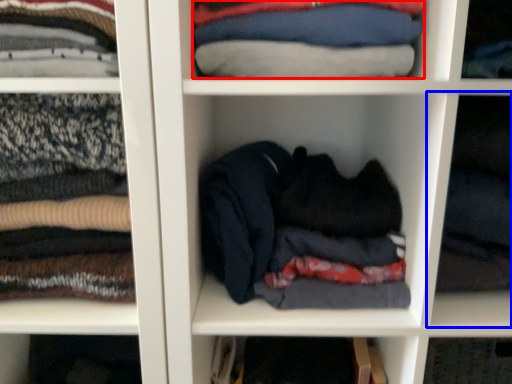
Question: Which point is closer to the camera, clothing (highlighted by a red box) or cabinet (highlighted by a blue box)?

Choices:
 (A) clothing
 (B) cabinet

Answer: (B)